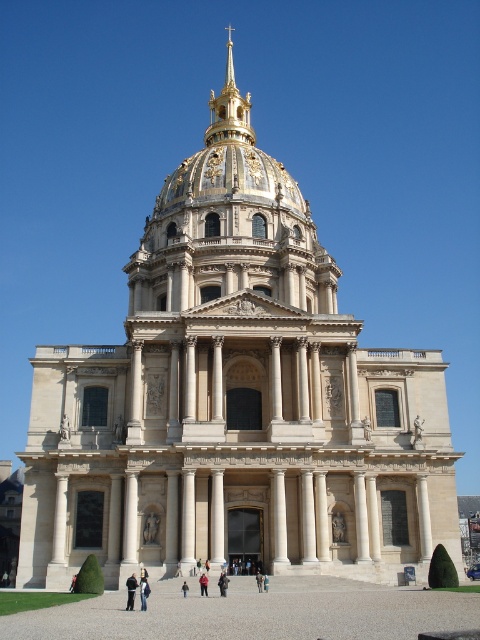
You are standing in front of the grand neoclassical building and see a point marked at coordinates (204, 582). Based on the scene description, can you determine what object this point is located on?

The point at coordinates (204, 582) is on the red fabric person at center.